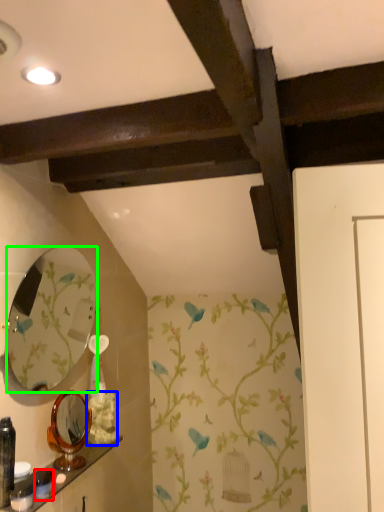
Question: Based on their relative distances, which object is farther from toiletry (highlighted by a red box)? Choose from flower (highlighted by a blue box) and mirror (highlighted by a green box).

Choices:
 (A) flower
 (B) mirror

Answer: (B)